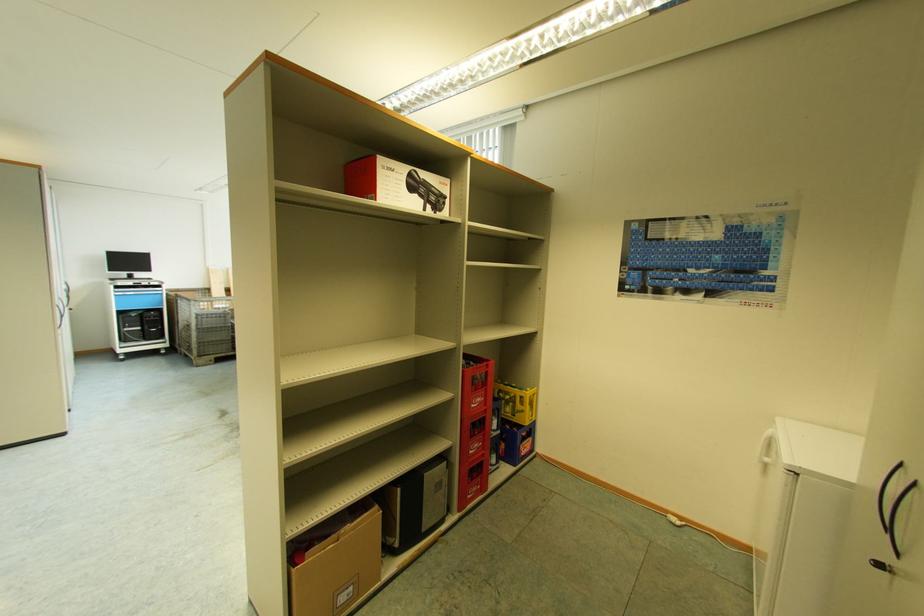
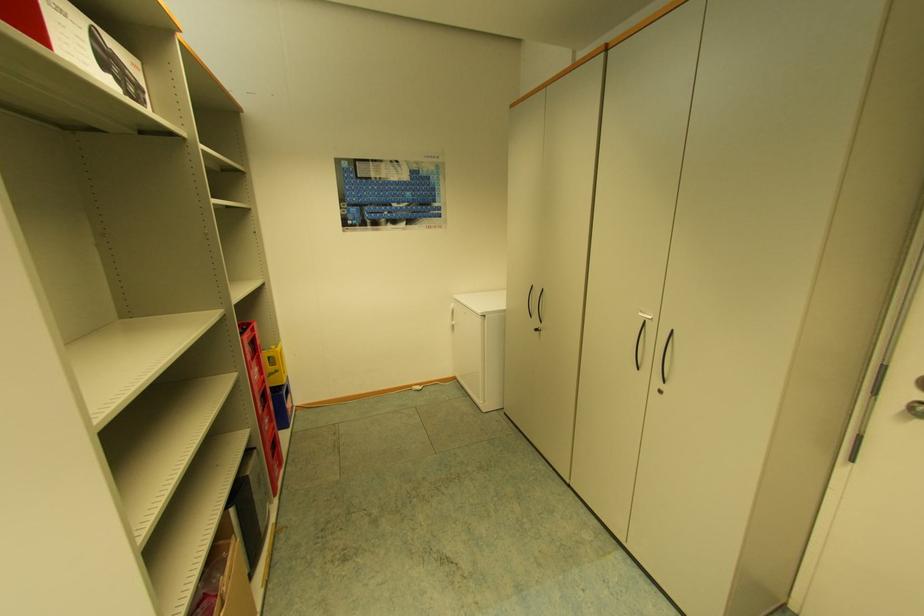
Find the pixel in the second image that matches the point at 419,195 in the first image.

(115, 78)